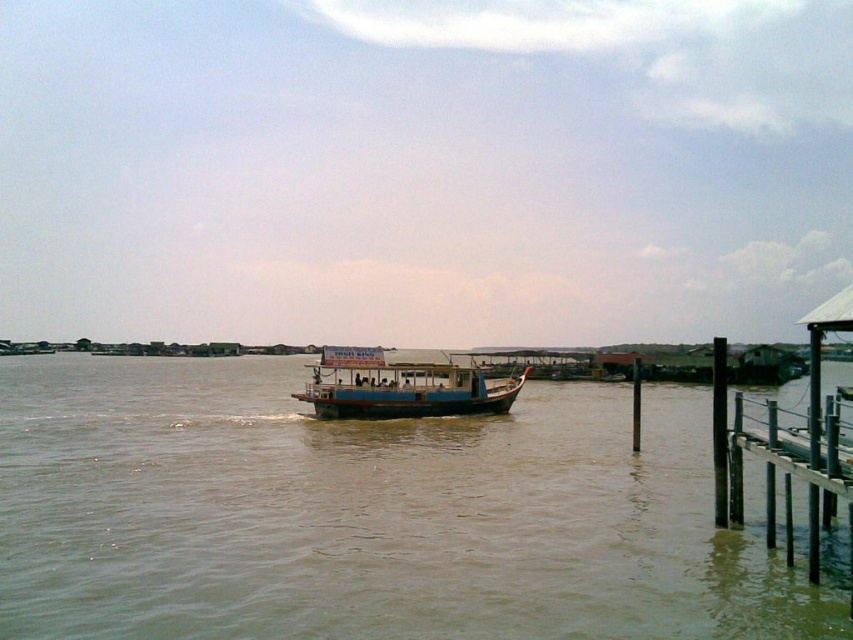
Question: Based on their relative distances, which object is nearer to the blue wooden boat at center?

Choices:
 (A) brown muddy water at center
 (B) black metal dock at lower right

Answer: (A)

Question: Which object is farther from the camera taking this photo?

Choices:
 (A) blue wooden boat at center
 (B) black metal dock at lower right
 (C) brown muddy water at center

Answer: (A)

Question: Does black metal dock at lower right have a smaller size compared to blue wooden boat at center?

Choices:
 (A) no
 (B) yes

Answer: (A)

Question: Does black metal dock at lower right appear under blue wooden boat at center?

Choices:
 (A) yes
 (B) no

Answer: (A)

Question: Which object appears farthest from the camera in this image?

Choices:
 (A) brown muddy water at center
 (B) black metal dock at lower right

Answer: (B)

Question: Can you confirm if black metal dock at lower right is wider than blue wooden boat at center?

Choices:
 (A) no
 (B) yes

Answer: (B)